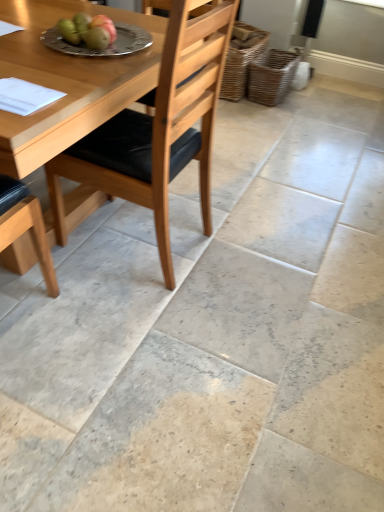
You are a GUI agent. You are given a task and a screenshot of the screen. Output one action in this format:
    pyautogui.click(x=<x>, y=<y>)
    Task: Click on the free point above white paper at upper left (from a real-world perspective)
    
    Given the screenshot: What is the action you would take?
    pyautogui.click(x=21, y=91)